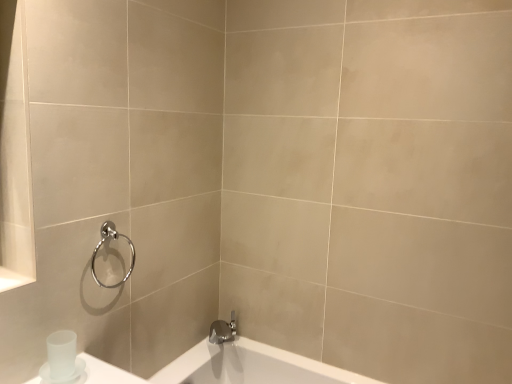
Question: Considering the relative sizes of satin nickel faucet at lower center and satin white cup at lower left in the image provided, is satin nickel faucet at lower center thinner than satin white cup at lower left?

Choices:
 (A) no
 (B) yes

Answer: (A)

Question: From the image's perspective, is satin nickel faucet at lower center located beneath satin white cup at lower left?

Choices:
 (A) yes
 (B) no

Answer: (A)

Question: Is satin nickel faucet at lower center oriented away from satin white cup at lower left?

Choices:
 (A) yes
 (B) no

Answer: (B)

Question: Is satin nickel faucet at lower center located outside satin white cup at lower left?

Choices:
 (A) no
 (B) yes

Answer: (B)

Question: Does satin nickel faucet at lower center have a smaller size compared to satin white cup at lower left?

Choices:
 (A) no
 (B) yes

Answer: (A)

Question: Would you say satin nickel faucet at lower center contains satin white cup at lower left?

Choices:
 (A) yes
 (B) no

Answer: (B)

Question: Is satin nickel faucet at lower center at the back of satin white cup at lower left?

Choices:
 (A) yes
 (B) no

Answer: (B)

Question: Would you say satin nickel faucet at lower center is part of satin white cup at lower left's contents?

Choices:
 (A) yes
 (B) no

Answer: (B)

Question: From a real-world perspective, is satin white cup at lower left beneath satin nickel faucet at lower center?

Choices:
 (A) no
 (B) yes

Answer: (A)

Question: Is the depth of satin white cup at lower left less than that of satin nickel faucet at lower center?

Choices:
 (A) yes
 (B) no

Answer: (A)

Question: Considering the relative sizes of satin white cup at lower left and satin nickel faucet at lower center in the image provided, is satin white cup at lower left bigger than satin nickel faucet at lower center?

Choices:
 (A) no
 (B) yes

Answer: (A)

Question: Can you confirm if satin white cup at lower left is taller than satin nickel faucet at lower center?

Choices:
 (A) no
 (B) yes

Answer: (B)

Question: From the image's perspective, would you say polished chrome towel ring at upper left is positioned over satin nickel faucet at lower center?

Choices:
 (A) no
 (B) yes

Answer: (B)